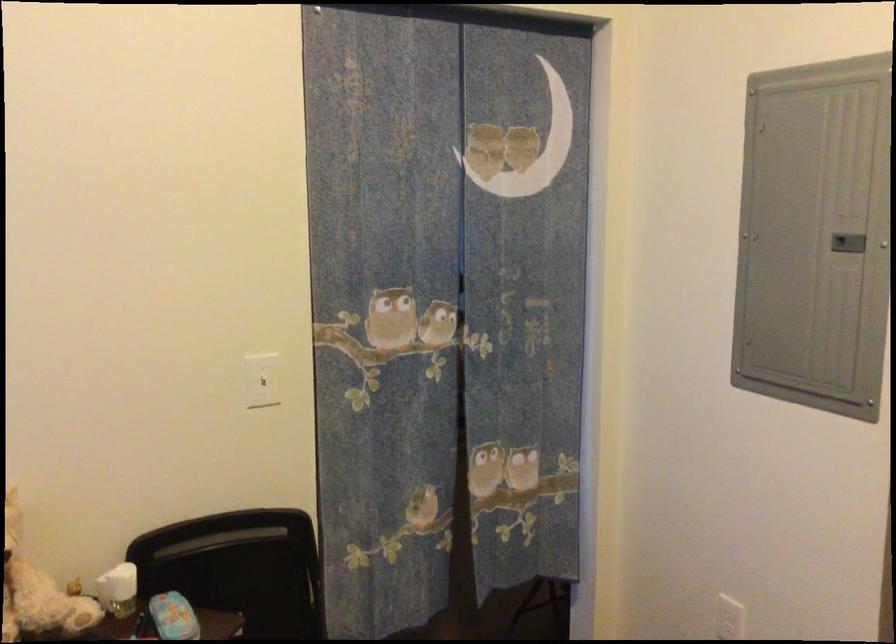
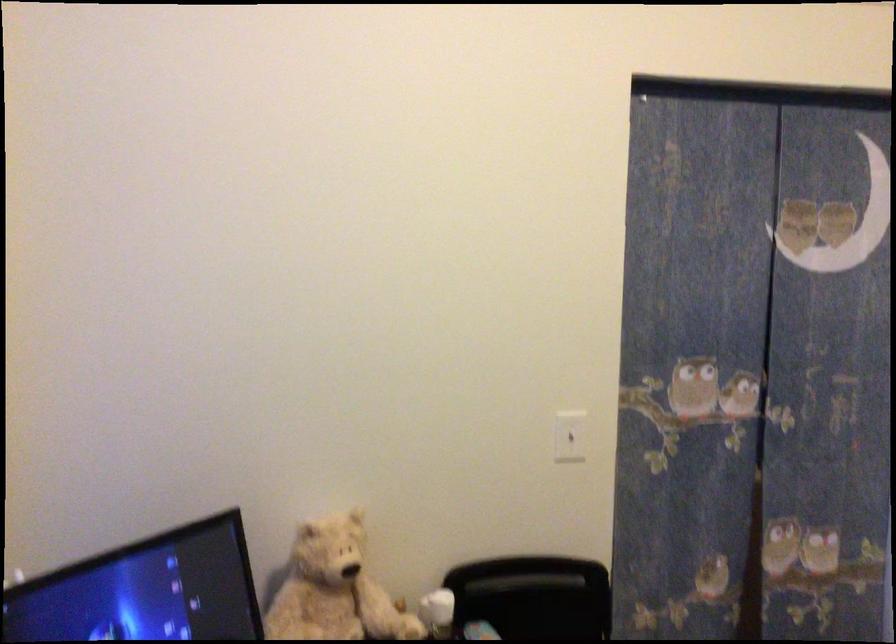
In a continuous first-person perspective shot, in which direction is the camera moving?

The cameraman walked toward left, backward.